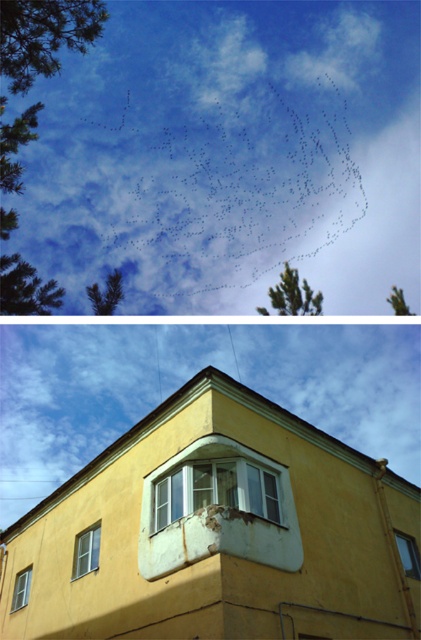
Can you confirm if white plastic window at center is positioned below white glass window at upper center?

No, white plastic window at center is not below white glass window at upper center.

Which is behind, point (175, 481) or point (26, 579)?

The point (26, 579) is behind.

Between point (252, 504) and point (23, 577), which one is positioned behind?

Point (23, 577)

Identify the location of white plastic window at center. The image size is (421, 640). (215, 490).

From the picture: Does white plastic window at center have a greater width compared to clear glass window at lower left?

Indeed, white plastic window at center has a greater width compared to clear glass window at lower left.

Describe the element at coordinates (215, 490) in the screenshot. The height and width of the screenshot is (640, 421). I see `white plastic window at center` at that location.

The width and height of the screenshot is (421, 640). Find the location of `white plastic window at center`. white plastic window at center is located at coordinates (215, 490).

Who is higher up, clear glass window at lower left or clear glass window at lower right?

Positioned higher is clear glass window at lower left.

Can you confirm if clear glass window at lower left is thinner than clear glass window at lower right?

In fact, clear glass window at lower left might be wider than clear glass window at lower right.

Is point (96, 547) farther from viewer compared to point (413, 547)?

No, it is in front of (413, 547).

At what (x,y) coordinates should I click in order to perform the action: click on clear glass window at lower left. Please return your answer as a coordinate pair (x, y). Looking at the image, I should click on (87, 550).